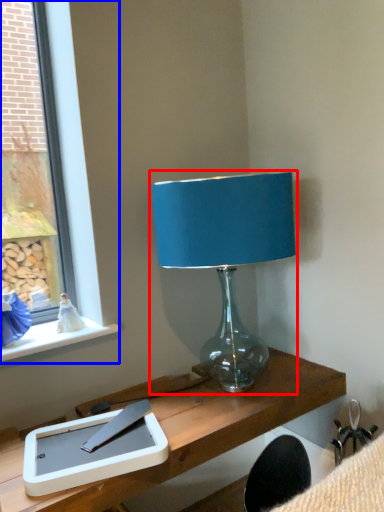
Question: Among these objects, which one is farthest to the camera, lamp (highlighted by a red box) or window (highlighted by a blue box)?

Choices:
 (A) lamp
 (B) window

Answer: (B)